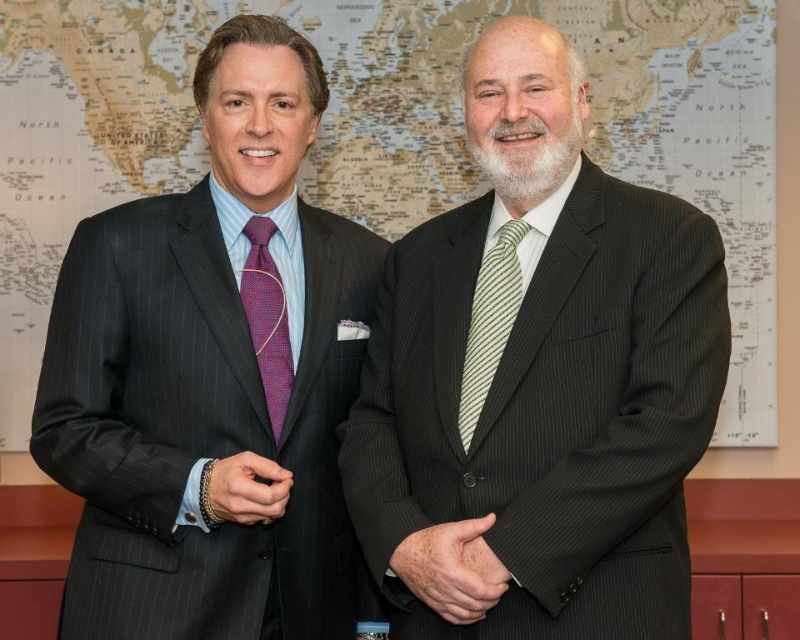
Question: Is matte black suit at left wider than map paper at upper center?

Choices:
 (A) yes
 (B) no

Answer: (B)

Question: Does matte black suit at center appear under purple woven tie at left?

Choices:
 (A) yes
 (B) no

Answer: (A)

Question: Does matte black suit at center appear over purple woven tie at left?

Choices:
 (A) yes
 (B) no

Answer: (B)

Question: Which object is closer to the camera taking this photo?

Choices:
 (A) matte black suit at left
 (B) map paper at upper center
 (C) striped silk tie at center
 (D) purple woven tie at left

Answer: (A)

Question: Estimate the real-world distances between objects in this image. Which object is closer to the matte black suit at center?

Choices:
 (A) matte black suit at left
 (B) striped silk tie at center
 (C) purple woven tie at left

Answer: (B)

Question: Which of the following is the closest to the observer?

Choices:
 (A) matte black suit at left
 (B) map paper at upper center
 (C) matte black suit at center
 (D) striped silk tie at center

Answer: (C)